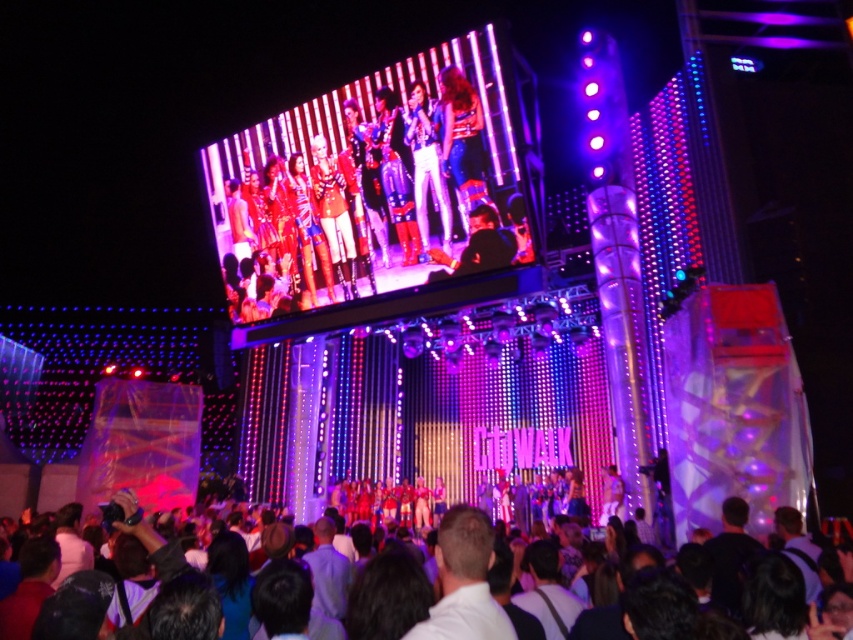
You are attending the concert and want to take a photo of the shiny metallic jacket at center and dark brown hair at lower center. To ensure both are in focus, which part should you focus on first?

The shiny metallic jacket at center is above dark brown hair at lower center, so you should focus on the shiny metallic jacket at center first as it is closer to the camera.

You are standing at the back of the concert venue and want to take a photo of both the point at coordinates point (494,227) and point (212,636). Which point is closer to your camera?

Point (212,636) is closer to the camera because it is less further away than point (494,227).

You are attending the concert and want to take a photo of both the shiny metallic jacket at center and the dark brown hair at lower center. Which object should you focus on first if you want to capture both in one frame without moving your camera?

The shiny metallic jacket at center is to the left of dark brown hair at lower center, so you should focus on the shiny metallic jacket at center first to ensure both are in the frame.